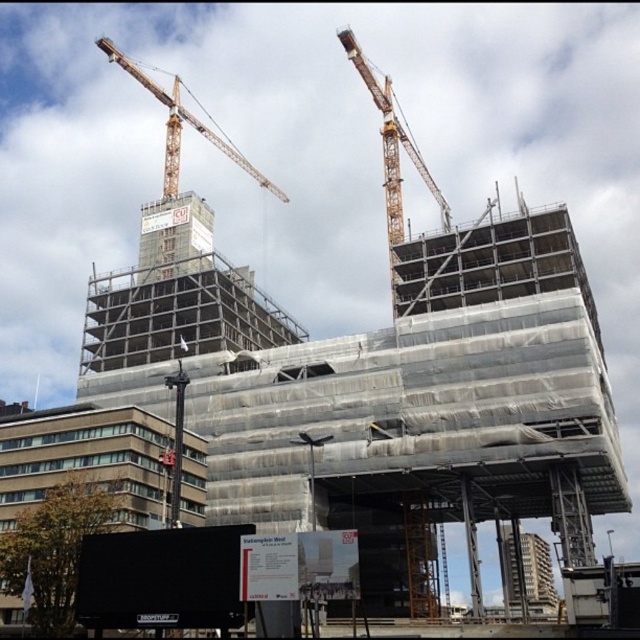
Question: Is yellow metallic crane at upper center wider than orange metallic crane at upper left?

Choices:
 (A) yes
 (B) no

Answer: (B)

Question: Is yellow metallic crane at upper center behind orange metallic crane at upper left?

Choices:
 (A) yes
 (B) no

Answer: (B)

Question: Which of the following is the closest to the observer?

Choices:
 (A) yellow metallic crane at upper center
 (B) orange metallic crane at upper left

Answer: (A)

Question: Is yellow metallic crane at upper center to the right of orange metallic crane at upper left from the viewer's perspective?

Choices:
 (A) no
 (B) yes

Answer: (B)